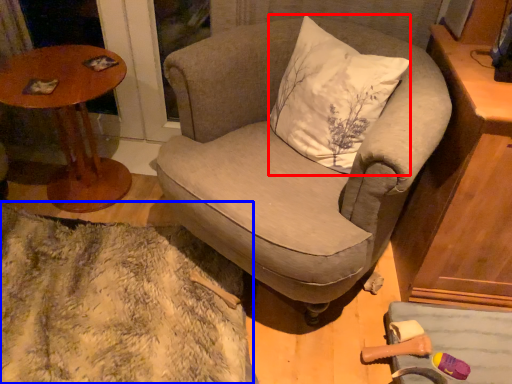
Question: Which object appears closest to the camera in this image, pillow (highlighted by a red box) or blanket (highlighted by a blue box)?

Choices:
 (A) pillow
 (B) blanket

Answer: (A)